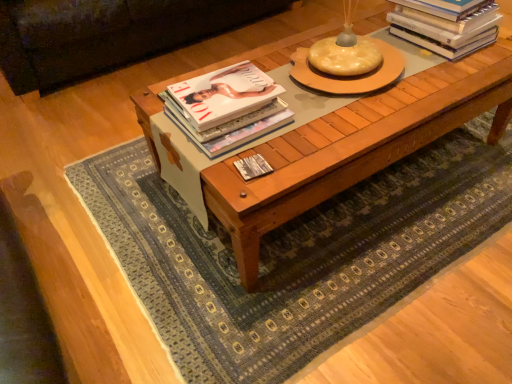
You are a GUI agent. You are given a task and a screenshot of the screen. Output one action in this format:
    pyautogui.click(x=<x>, y=<y>)
    Task: Click on the free spot below woven rug at center (from a real-world perspective)
    The width and height of the screenshot is (512, 384).
    Given the screenshot: What is the action you would take?
    pyautogui.click(x=353, y=213)